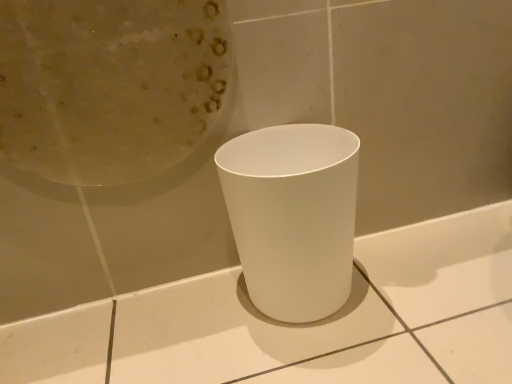
Locate an element on the screen. This screenshot has height=384, width=512. free space in front of white matte vase at center is located at coordinates (342, 359).